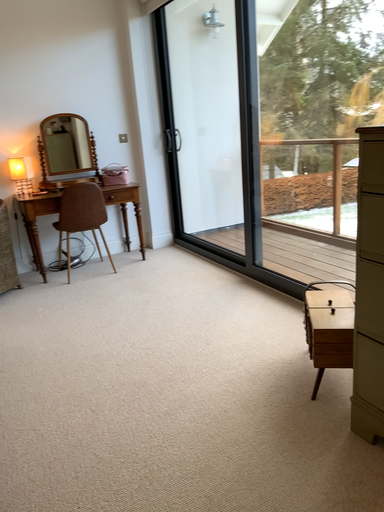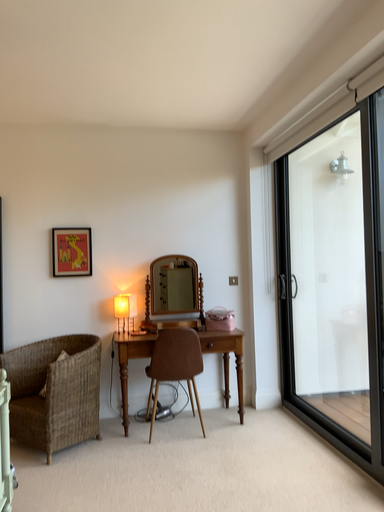
Question: Which way did the camera rotate in the video?

Choices:
 (A) rotated downward
 (B) rotated upward

Answer: (B)